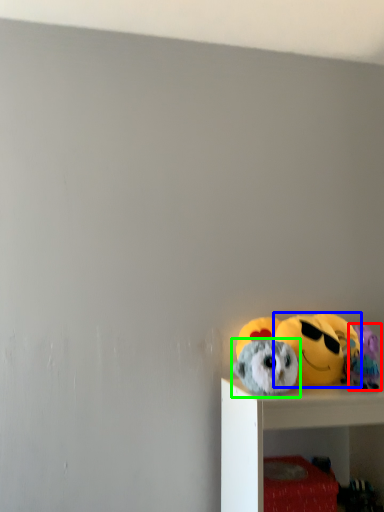
Question: Based on their relative distances, which object is nearer to toy (highlighted by a red box)? Choose from toy (highlighted by a blue box) and toy (highlighted by a green box).

Choices:
 (A) toy
 (B) toy

Answer: (A)